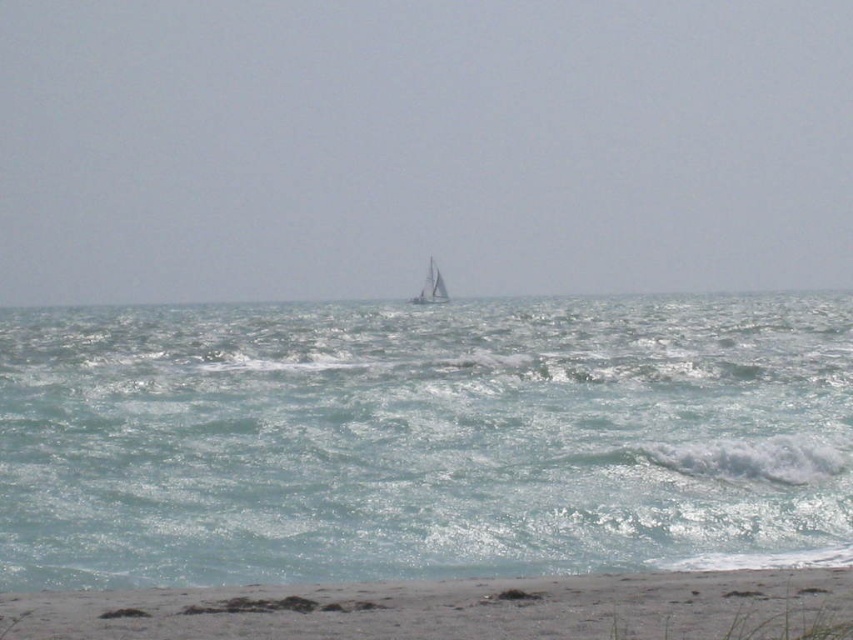
Question: Estimate the real-world distances between objects in this image. Which object is farther from the clear blue water at center?

Choices:
 (A) sandy beach at lower center
 (B) white sailboat at center

Answer: (A)

Question: Where is clear blue water at center located in relation to sandy beach at lower center in the image?

Choices:
 (A) left
 (B) right

Answer: (A)

Question: Which object appears closest to the camera in this image?

Choices:
 (A) sandy beach at lower center
 (B) clear blue water at center

Answer: (A)

Question: Is sandy beach at lower center below white sailboat at center?

Choices:
 (A) yes
 (B) no

Answer: (A)

Question: Which point appears farthest from the camera in this image?

Choices:
 (A) (x=235, y=634)
 (B) (x=433, y=275)

Answer: (B)

Question: Can you confirm if clear blue water at center is positioned to the right of white sailboat at center?

Choices:
 (A) no
 (B) yes

Answer: (A)